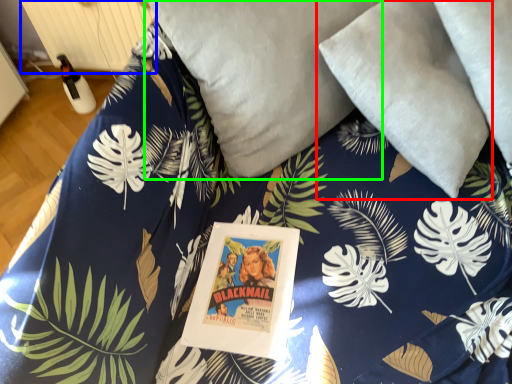
Question: Which object is positioned farthest from pillow (highlighted by a red box)? Select from radiator (highlighted by a blue box) and pillow (highlighted by a green box).

Choices:
 (A) radiator
 (B) pillow

Answer: (A)